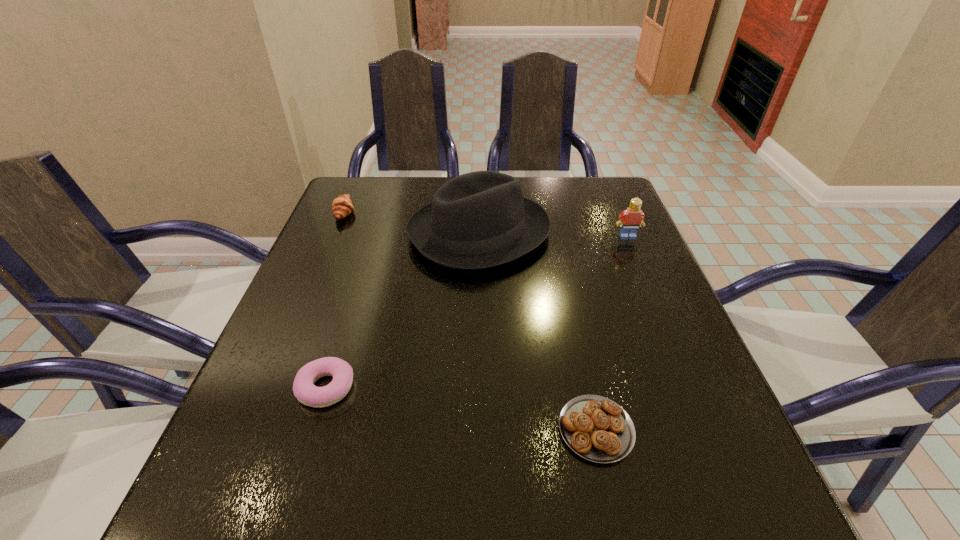
This screenshot has width=960, height=540. I want to click on free region located on the back of the second pastry from left to right, so click(x=347, y=321).

This screenshot has height=540, width=960. I want to click on vacant space located on the left of the rightmost pastry, so click(509, 429).

You are a GUI agent. You are given a task and a screenshot of the screen. Output one action in this format:
    pyautogui.click(x=<x>, y=<y>)
    Task: Click on the fedora that is at the far edge
    The width and height of the screenshot is (960, 540).
    Given the screenshot: What is the action you would take?
    pyautogui.click(x=477, y=220)

Locate an element on the screen. Image resolution: width=960 pixels, height=540 pixels. pastry located in the far edge section of the desktop is located at coordinates (342, 206).

You are a GUI agent. You are given a task and a screenshot of the screen. Output one action in this format:
    pyautogui.click(x=<x>, y=<y>)
    Task: Click on the Lego that is at the right edge
    This screenshot has height=540, width=960.
    Given the screenshot: What is the action you would take?
    [630, 219]

The image size is (960, 540). In order to click on pastry located at the right edge in this screenshot , I will do `click(596, 428)`.

Locate an element on the screen. The width and height of the screenshot is (960, 540). object present at the far left corner is located at coordinates (342, 206).

You are a GUI agent. You are given a task and a screenshot of the screen. Output one action in this format:
    pyautogui.click(x=<x>, y=<y>)
    Task: Click on the free space at the far edge of the desktop
    
    Given the screenshot: What is the action you would take?
    pyautogui.click(x=427, y=191)

The width and height of the screenshot is (960, 540). I want to click on free region at the near edge, so click(x=553, y=514).

This screenshot has height=540, width=960. I want to click on vacant space at the left edge, so click(x=294, y=321).